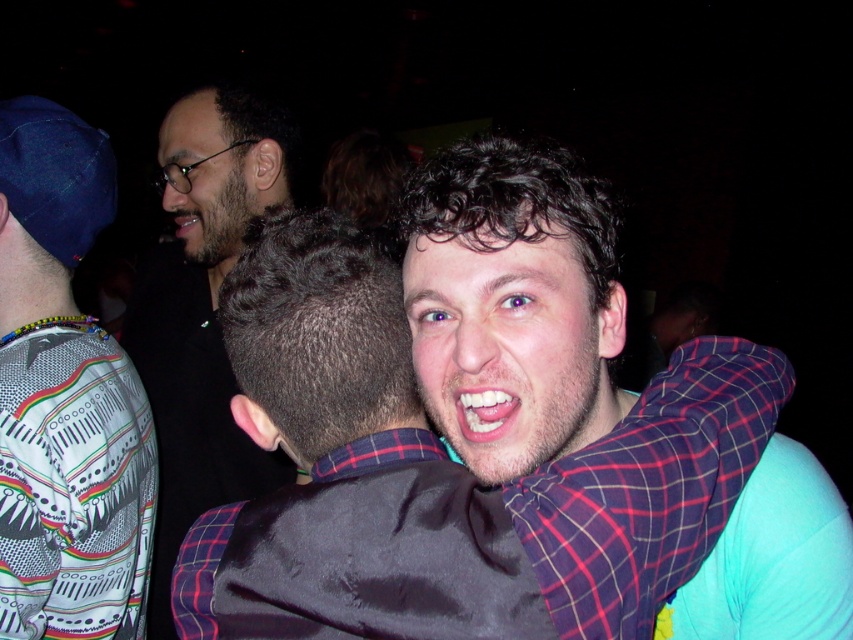
You are standing in the center of the room and want to hand a drink to the person wearing the plaid shirt at center. In which direction should you move to reach them?

The plaid shirt at center is located at point coordinates (x=514, y=304), so you should move towards the center of the room to reach them.

You are at a party and want to approach the person wearing the plaid shirt at center without walking through the white dotted shirt at upper left. Is there a clear path around them?

The plaid shirt at center is positioned under the white dotted shirt at upper left, meaning they are directly below it. Since the white dotted shirt at upper left is above, you can approach the plaid shirt at center by moving around the sides, as they are vertically aligned.